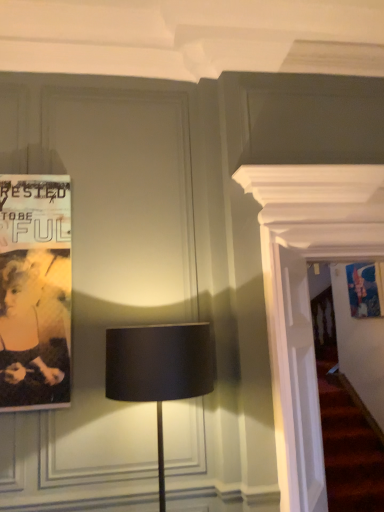
Question: Is black paper poster at left surrounding matte black lamp at center?

Choices:
 (A) yes
 (B) no

Answer: (B)

Question: Does black paper poster at left touch matte black lamp at center?

Choices:
 (A) no
 (B) yes

Answer: (A)

Question: Considering the relative sizes of black paper poster at left and matte black lamp at center in the image provided, is black paper poster at left taller than matte black lamp at center?

Choices:
 (A) yes
 (B) no

Answer: (A)

Question: Does black paper poster at left have a greater width compared to matte black lamp at center?

Choices:
 (A) yes
 (B) no

Answer: (B)

Question: Is black paper poster at left positioned with its back to matte black lamp at center?

Choices:
 (A) no
 (B) yes

Answer: (A)

Question: From the image's perspective, is black paper poster at left under matte black lamp at center?

Choices:
 (A) yes
 (B) no

Answer: (B)

Question: Is the depth of matte black lamp at center greater than that of black paper poster at left?

Choices:
 (A) yes
 (B) no

Answer: (B)

Question: Is matte black lamp at center outside black paper poster at left?

Choices:
 (A) no
 (B) yes

Answer: (B)

Question: From the image's perspective, is matte black lamp at center on black paper poster at left?

Choices:
 (A) no
 (B) yes

Answer: (A)

Question: Does matte black lamp at center have a larger size compared to black paper poster at left?

Choices:
 (A) no
 (B) yes

Answer: (B)

Question: Could you tell me if matte black lamp at center is facing black paper poster at left?

Choices:
 (A) no
 (B) yes

Answer: (A)

Question: Is matte black lamp at center turned away from black paper poster at left?

Choices:
 (A) no
 (B) yes

Answer: (A)

Question: Would you say matte black lamp at center is to the left or to the right of black paper poster at left in the picture?

Choices:
 (A) right
 (B) left

Answer: (A)